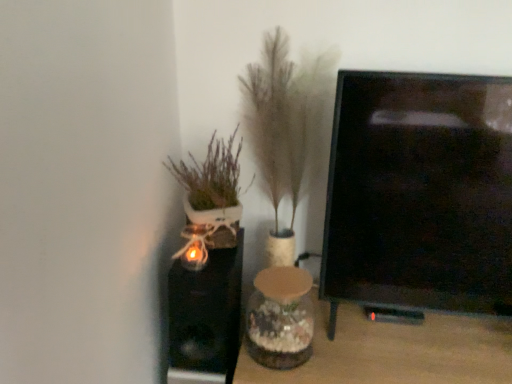
Image resolution: width=512 pixels, height=384 pixels. Find the location of `spots to the right of fuzzy beige plant at center, the 2th houseplant when ordered from left to right`. spots to the right of fuzzy beige plant at center, the 2th houseplant when ordered from left to right is located at coordinates (330, 305).